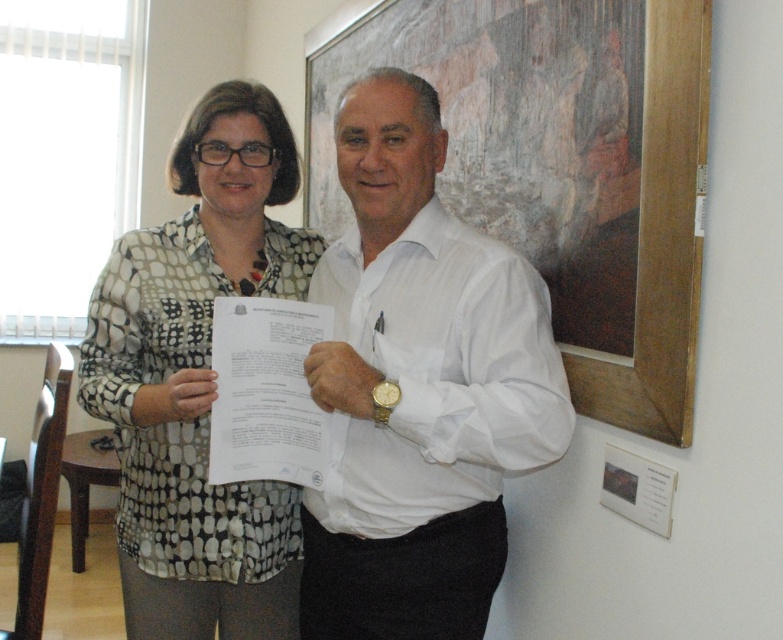
Consider the image. Is wooden at right wider than polka dot blouse at center?

Yes.

Who is taller, wooden at right or polka dot blouse at center?

wooden at right is taller.

Is point (312, 58) in front of point (179, 369)?

That is False.

Where is `wooden at right`? The image size is (783, 640). wooden at right is located at coordinates (561, 166).

At what (x,y) coordinates should I click in order to perform the action: click on white smooth shirt at center. Please return your answer as a coordinate pair (x, y). The width and height of the screenshot is (783, 640). Looking at the image, I should click on (419, 387).

Is white smooth shirt at center further to camera compared to polka dot blouse at center?

No, white smooth shirt at center is closer to the viewer.

Image resolution: width=783 pixels, height=640 pixels. What are the coordinates of `white smooth shirt at center` in the screenshot? It's located at (419, 387).

The height and width of the screenshot is (640, 783). In order to click on white smooth shirt at center in this screenshot , I will do click(419, 387).

Measure the distance between white smooth shirt at center and camera.

The distance of white smooth shirt at center from camera is 3.90 feet.

Can you confirm if white smooth shirt at center is thinner than wooden at right?

Correct, white smooth shirt at center's width is less than wooden at right's.

Who is more distant from viewer, (x=473, y=541) or (x=599, y=256)?

Point (x=473, y=541)

You are a GUI agent. You are given a task and a screenshot of the screen. Output one action in this format:
    pyautogui.click(x=<x>, y=<y>)
    Task: Click on the white smooth shirt at center
    Image resolution: width=783 pixels, height=640 pixels.
    Given the screenshot: What is the action you would take?
    pyautogui.click(x=419, y=387)